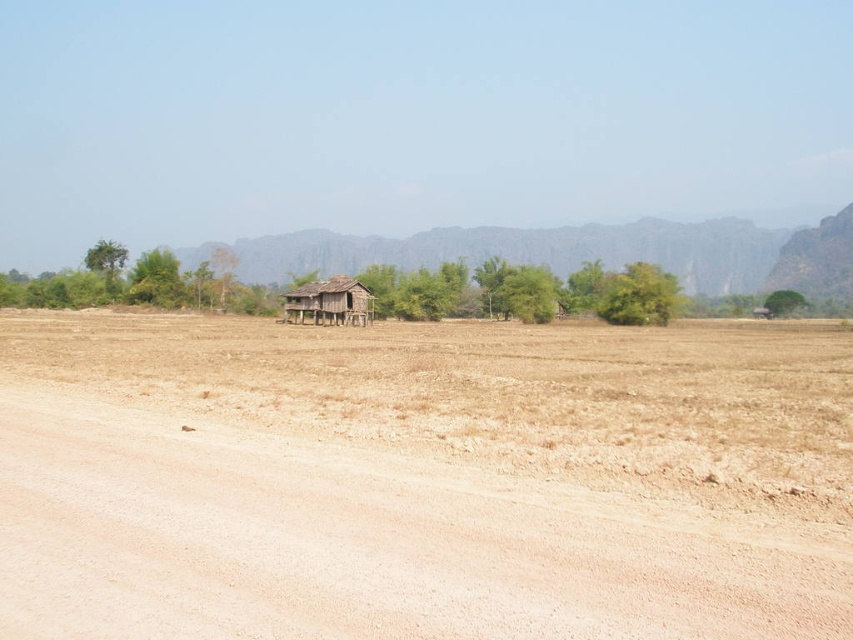
Question: Is brown dirt field at center below rugged stone mountain at center?

Choices:
 (A) yes
 (B) no

Answer: (A)

Question: Considering the relative positions of rugged stone mountain at center and weathered wood hut at center in the image provided, where is rugged stone mountain at center located with respect to weathered wood hut at center?

Choices:
 (A) below
 (B) above

Answer: (B)

Question: Among these objects, which one is nearest to the camera?

Choices:
 (A) weathered wood hut at center
 (B) rugged stone mountain at center

Answer: (A)

Question: Which object is farther from the camera taking this photo?

Choices:
 (A) weathered wood hut at center
 (B) brown dirt field at center

Answer: (A)

Question: Can you confirm if brown dirt field at center is positioned above rugged stone mountain at center?

Choices:
 (A) yes
 (B) no

Answer: (B)

Question: Which of the following is the closest to the observer?

Choices:
 (A) rugged stone mountain at center
 (B) weathered wood hut at center

Answer: (B)